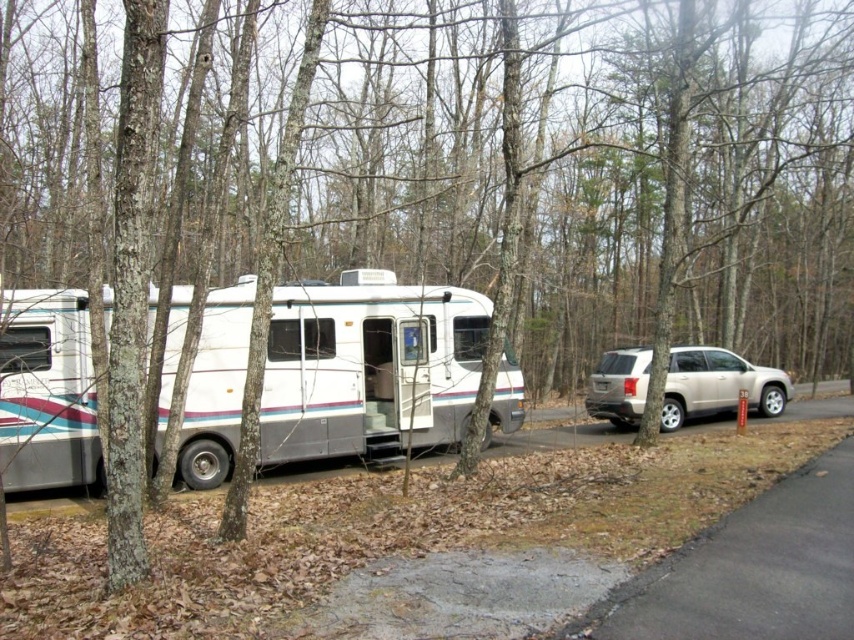
Question: Which point appears closest to the camera in this image?

Choices:
 (A) (617, 417)
 (B) (510, 364)

Answer: (B)

Question: Is white glossy recreational vehicle at center to the left of satin gold suv at right from the viewer's perspective?

Choices:
 (A) yes
 (B) no

Answer: (A)

Question: Can you confirm if white glossy recreational vehicle at center is positioned below satin gold suv at right?

Choices:
 (A) no
 (B) yes

Answer: (A)

Question: Which object is farther from the camera taking this photo?

Choices:
 (A) satin gold suv at right
 (B) white glossy recreational vehicle at center

Answer: (A)

Question: Which of the following is the farthest from the observer?

Choices:
 (A) white glossy recreational vehicle at center
 (B) satin gold suv at right

Answer: (B)

Question: Is white glossy recreational vehicle at center behind satin gold suv at right?

Choices:
 (A) no
 (B) yes

Answer: (A)